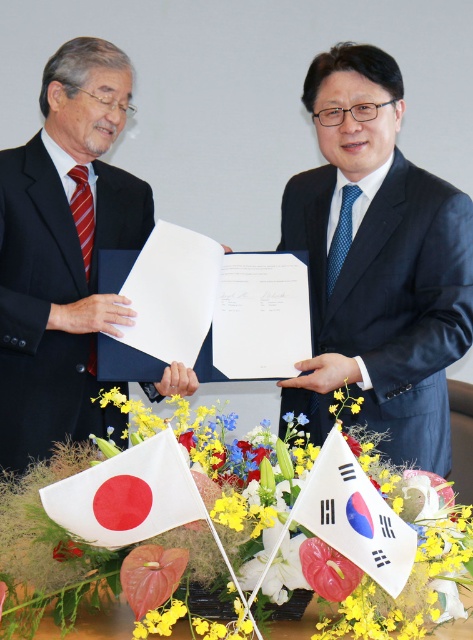
Does black matte suit at center have a greater height compared to white fabric flag at lower left?

Indeed, black matte suit at center has a greater height compared to white fabric flag at lower left.

Is point (419, 342) less distant than point (193, 504)?

That is False.

The width and height of the screenshot is (473, 640). I want to click on black matte suit at center, so click(x=377, y=262).

Identify the location of black matte suit at center. (377, 262).

Between dark blue suit at center and white fabric flag at center, which one is positioned lower?

white fabric flag at center

Does point (429, 465) lie in front of point (338, 541)?

No, (429, 465) is behind (338, 541).

Is point (425, 371) positioned behind point (353, 484)?

Yes, it is behind point (353, 484).

Where is `dark blue suit at center`? The width and height of the screenshot is (473, 640). dark blue suit at center is located at coordinates (x=393, y=298).

Which is below, black matte suit at center or yellow fabric flower at center?

yellow fabric flower at center is below.

Is point (71, 228) farther from camera compared to point (304, 528)?

Yes, it is.

Between point (322, 292) and point (112, 477), which one is positioned in front?

Point (112, 477) is more forward.

This screenshot has height=640, width=473. I want to click on black matte suit at center, so click(377, 262).